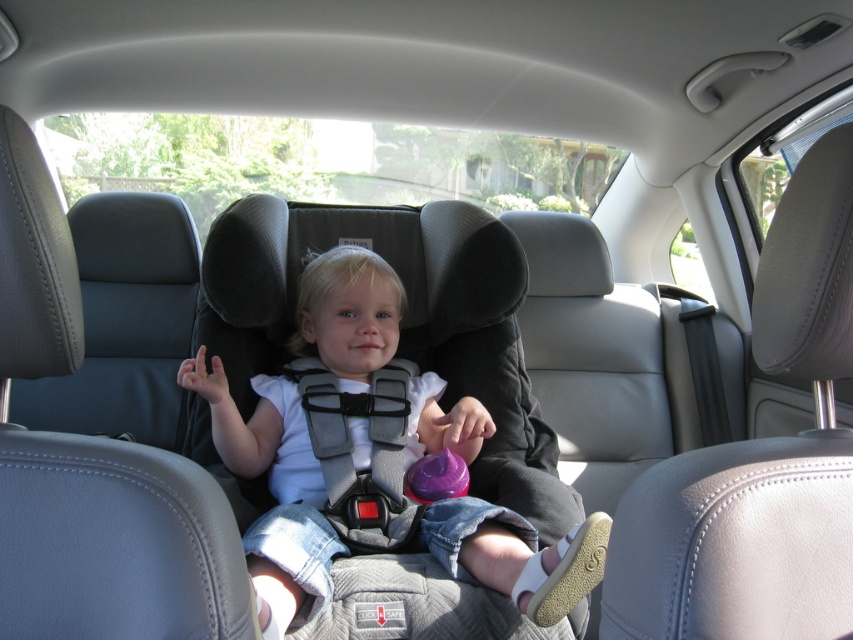
You are a parent trying to secure your child in the car. You notice the matte gray car seat at center and the gray fabric safety vest at center. Which item is positioned to the right side of the other?

The matte gray car seat at center is to the right of the gray fabric safety vest at center.

You are a delivery robot with a height of 1.5 meters. You need to deliver a package to the car seat. The car seat is at the center of the backseat. Can you reach the matte gray car seat at center to place the package on top?

The matte gray car seat at center is 1.21 meters away from camera. Since the robot is 1.5 meters tall, it can reach the matte gray car seat at center as the distance is within its operational range.

You are a parent preparing to secure your child in the car. You see the matte gray car seat at center and the gray fabric safety vest at center. Which item is taller?

The matte gray car seat at center is much taller than the gray fabric safety vest at center.